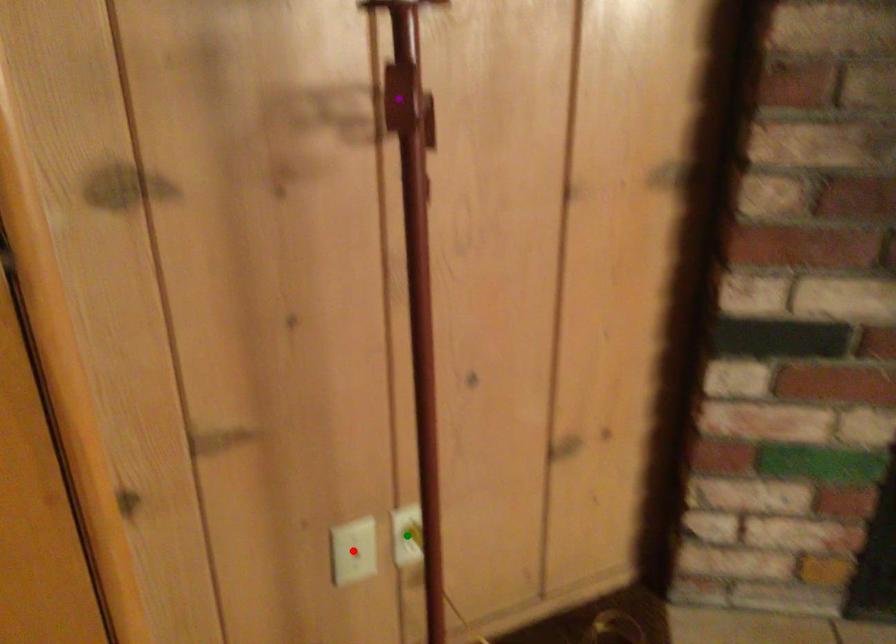
Order these from nearest to farthest:
red point, purple point, green point

purple point < red point < green point